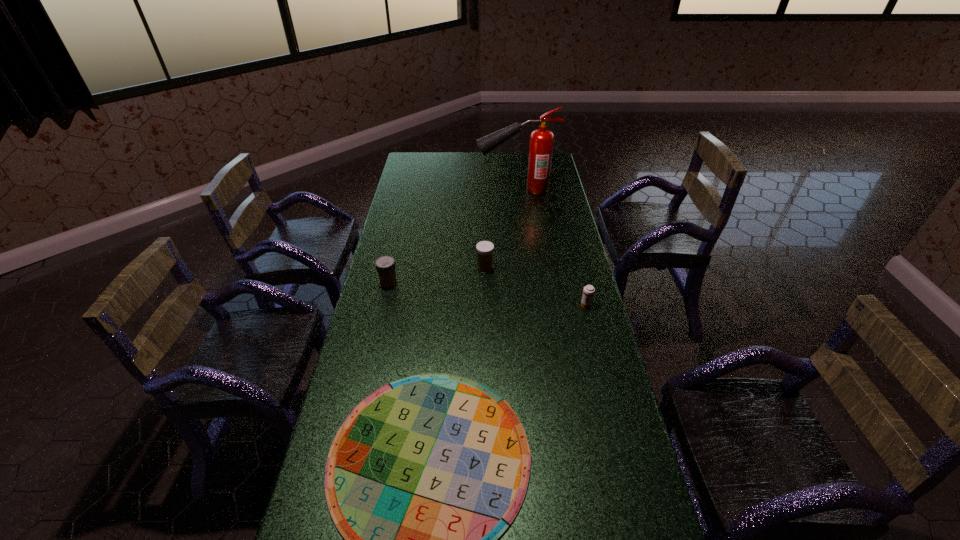
Identify which medicine is located as the third nearest to the nearest object. Please provide its 2D coordinates. Your answer should be formatted as a tuple, i.e. [(x, y)], where the tuple contains the x and y coordinates of a point satisfying the conditions above.

[(485, 249)]

Identify which medicine is the second closest to the nearest medicine. Please provide its 2D coordinates. Your answer should be formatted as a tuple, i.e. [(x, y)], where the tuple contains the x and y coordinates of a point satisfying the conditions above.

[(385, 265)]

Find the location of a particular element. vacant point that satisfies the following two spatial constraints: 1. on the label side of the leftmost medicine; 2. on the left side of the rightmost medicine is located at coordinates (384, 305).

The image size is (960, 540). Identify the location of free spot that satisfies the following two spatial constraints: 1. on the label side of the third farthest object; 2. on the left side of the second nearest object. (384, 305).

This screenshot has width=960, height=540. Identify the location of free spot that satisfies the following two spatial constraints: 1. at the nozzle of the nearest medicine; 2. on the right side of the fire extinguisher. (531, 305).